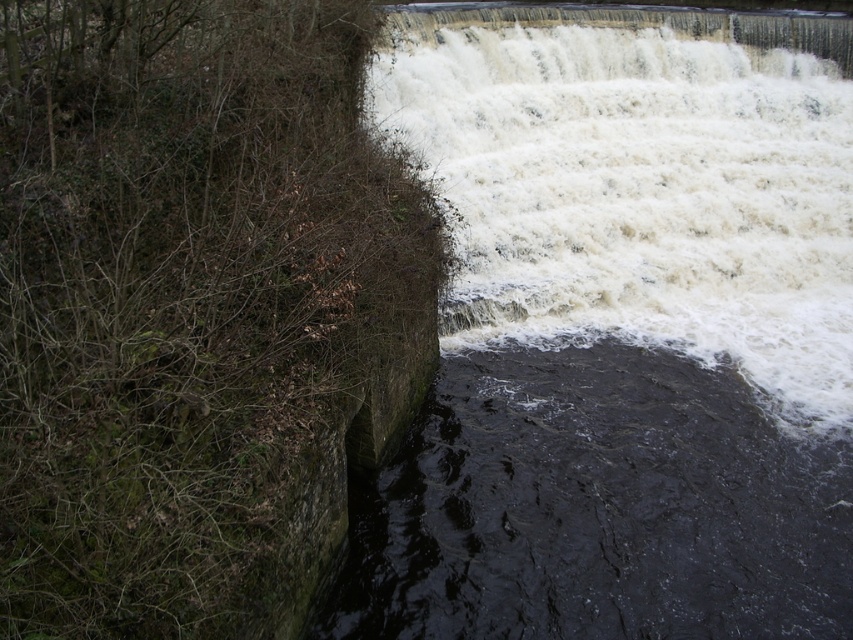
Who is lower down, white frothy water at upper right or dark stone river at lower left?

dark stone river at lower left is below.

Which is more to the right, white frothy water at upper right or dark stone river at lower left?

Positioned to the right is white frothy water at upper right.

Where is `white frothy water at upper right`? Image resolution: width=853 pixels, height=640 pixels. white frothy water at upper right is located at coordinates (639, 196).